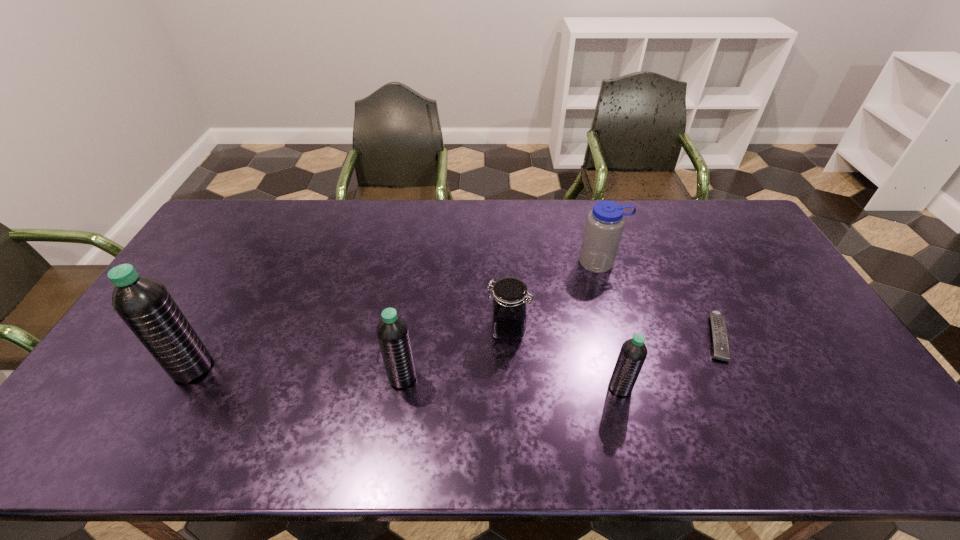
What are the coordinates of `vacant space positioned 0.170m with a carrying loop on the side of the farthest object` in the screenshot? It's located at point(614,315).

Find the location of a particular element. The image size is (960, 540). free space located 0.160m on the back of the rightmost object is located at coordinates (687, 276).

Find the location of a particular element. The height and width of the screenshot is (540, 960). free point located 0.120m on the lid of the jar is located at coordinates (444, 329).

At what (x,y) coordinates should I click in order to perform the action: click on free region located 0.140m on the lid of the jar. Please return your answer as a coordinate pair (x, y). Looking at the image, I should click on (438, 329).

Identify the location of free location located on the lid of the jar. This screenshot has height=540, width=960. (462, 329).

I want to click on vacant space at the far edge of the desktop, so click(562, 230).

The width and height of the screenshot is (960, 540). Identify the location of free space at the near edge of the desktop. (492, 403).

The height and width of the screenshot is (540, 960). What are the coordinates of `free region at the right edge of the desktop` in the screenshot? It's located at (798, 348).

In the image, there is a desktop. In order to click on vacant space at the far right corner in this screenshot , I will do `click(717, 214)`.

Identify the location of unoccupied position between the farthest water bottle and the jar. (554, 296).